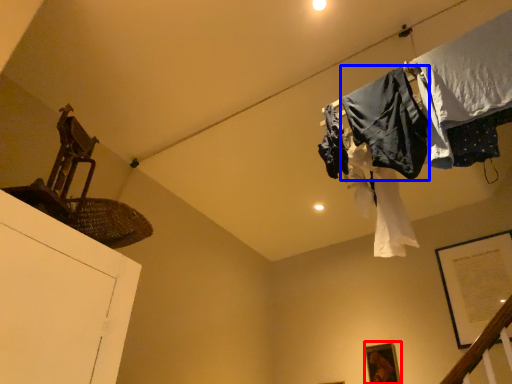
Question: Which object is further to the camera taking this photo, picture frame (highlighted by a red box) or clothing (highlighted by a blue box)?

Choices:
 (A) picture frame
 (B) clothing

Answer: (A)